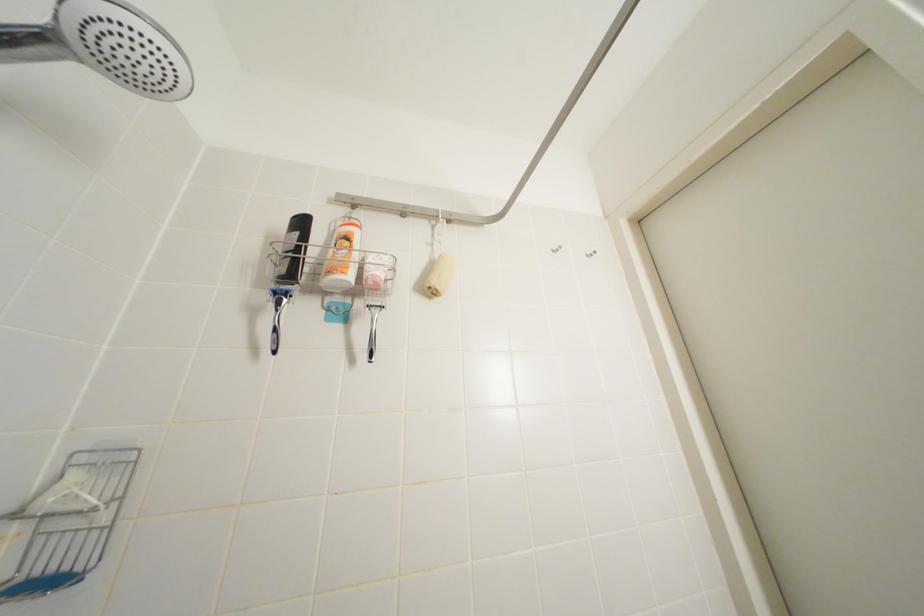
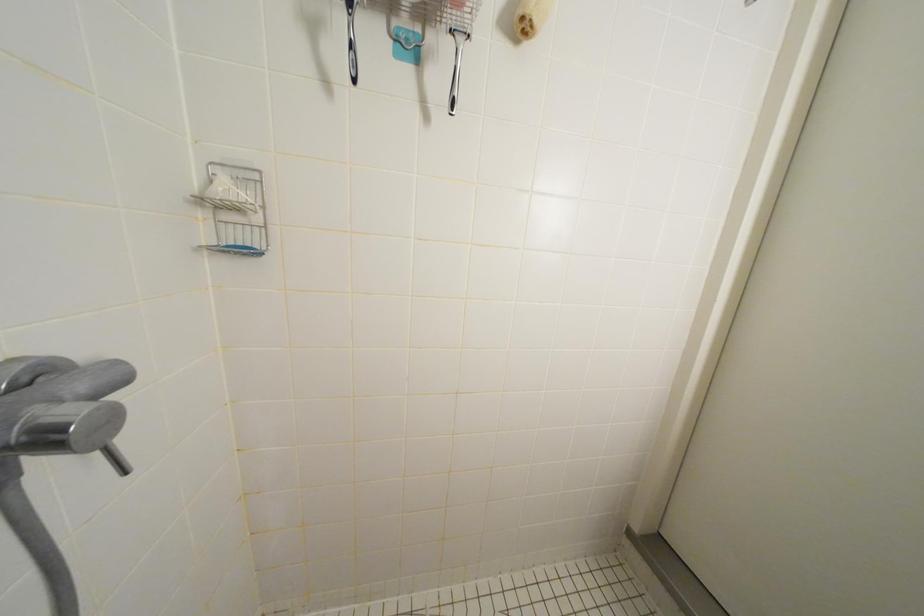
Question: Based on the continuous images, in which direction is the camera rotating? Reply with the corresponding letter.

Choices:
 (A) Left
 (B) Right
 (C) Up
 (D) Down

Answer: (D)